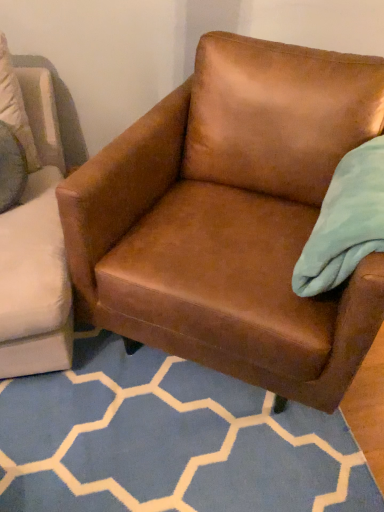
Question: Would you say brown leather chair at center is a long distance from brown leather armchair at center?

Choices:
 (A) yes
 (B) no

Answer: (B)

Question: From a real-world perspective, is brown leather chair at center below brown leather armchair at center?

Choices:
 (A) no
 (B) yes

Answer: (A)

Question: Is brown leather chair at center outside of brown leather armchair at center?

Choices:
 (A) no
 (B) yes

Answer: (B)

Question: Can you confirm if brown leather chair at center is shorter than brown leather armchair at center?

Choices:
 (A) yes
 (B) no

Answer: (B)

Question: Considering the relative positions of brown leather chair at center and brown leather armchair at center in the image provided, is brown leather chair at center to the left of brown leather armchair at center from the viewer's perspective?

Choices:
 (A) no
 (B) yes

Answer: (A)

Question: Can you confirm if brown leather chair at center is thinner than brown leather armchair at center?

Choices:
 (A) no
 (B) yes

Answer: (A)

Question: From a real-world perspective, is brown leather armchair at center physically above brown leather chair at center?

Choices:
 (A) no
 (B) yes

Answer: (A)

Question: Is brown leather armchair at center thinner than brown leather chair at center?

Choices:
 (A) yes
 (B) no

Answer: (A)

Question: Is brown leather chair at center at the back of brown leather armchair at center?

Choices:
 (A) no
 (B) yes

Answer: (A)

Question: Is brown leather armchair at center aimed at brown leather chair at center?

Choices:
 (A) yes
 (B) no

Answer: (A)

Question: Is brown leather armchair at center smaller than brown leather chair at center?

Choices:
 (A) no
 (B) yes

Answer: (B)

Question: Is brown leather chair at center located within brown leather armchair at center?

Choices:
 (A) no
 (B) yes

Answer: (A)

Question: Is brown leather chair at center inside or outside of brown leather armchair at center?

Choices:
 (A) outside
 (B) inside

Answer: (A)